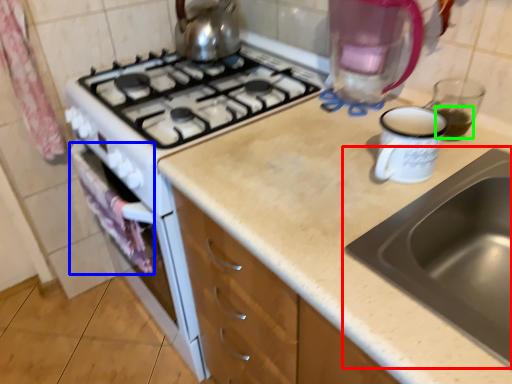
Question: Which object is the farthest from sink (highlighted by a red box)? Choose among these: cloth (highlighted by a blue box) or beverage (highlighted by a green box).

Choices:
 (A) cloth
 (B) beverage

Answer: (A)